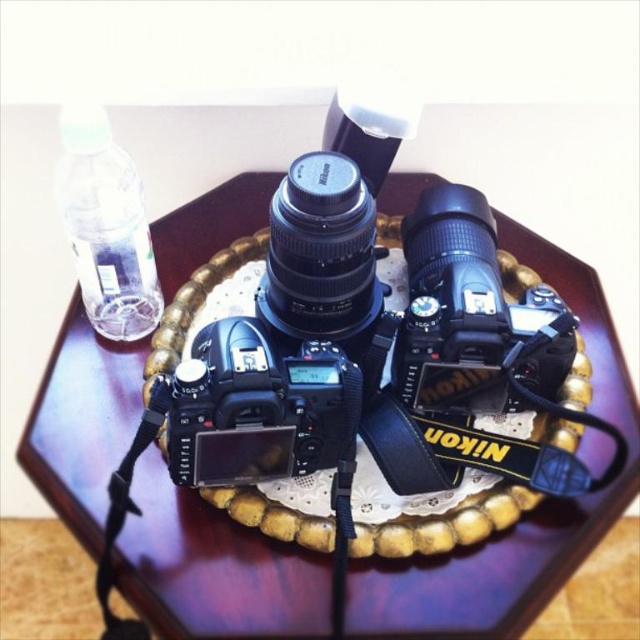
Is black matte camera at center above black matte digital camera at center?

Indeed, black matte camera at center is positioned over black matte digital camera at center.

Which of these two, black matte camera at center or black matte digital camera at center, stands shorter?

With less height is black matte digital camera at center.

The width and height of the screenshot is (640, 640). What do you see at coordinates (472, 316) in the screenshot? I see `black matte camera at center` at bounding box center [472, 316].

This screenshot has width=640, height=640. Find the location of `black matte camera at center`. black matte camera at center is located at coordinates (472, 316).

Can you confirm if black matte camera at center is shorter than clear plastic bottle at upper left?

In fact, black matte camera at center may be taller than clear plastic bottle at upper left.

Does black matte camera at center appear on the right side of clear plastic bottle at upper left?

Yes, black matte camera at center is to the right of clear plastic bottle at upper left.

Describe the element at coordinates (472, 316) in the screenshot. This screenshot has width=640, height=640. I see `black matte camera at center` at that location.

Image resolution: width=640 pixels, height=640 pixels. What are the coordinates of `black matte camera at center` in the screenshot? It's located at (472, 316).

Can you confirm if wooden tray at center is positioned below clear plastic bottle at upper left?

Yes.

Can you confirm if wooden tray at center is taller than clear plastic bottle at upper left?

Yes.

Find the location of a particular element. wooden tray at center is located at coordinates tap(522, 518).